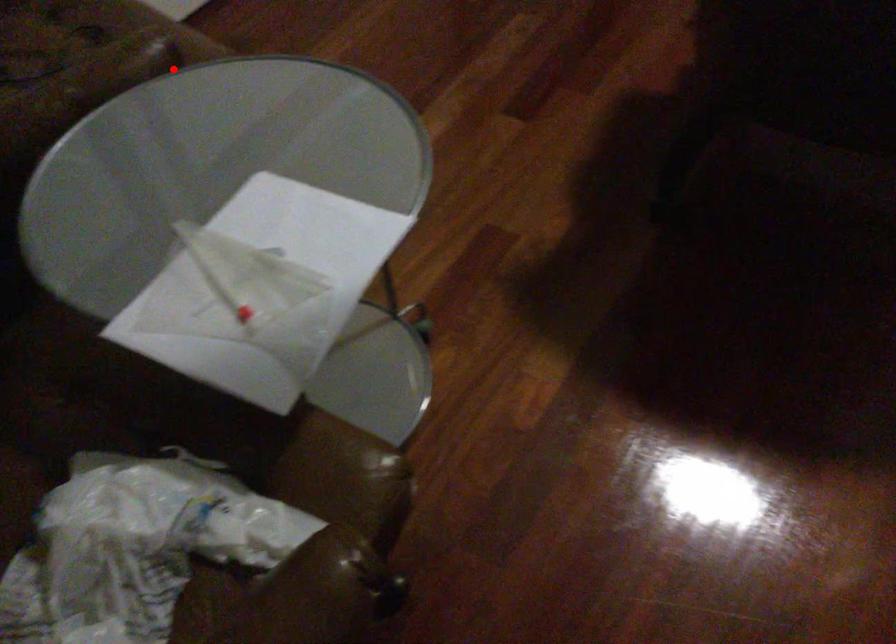
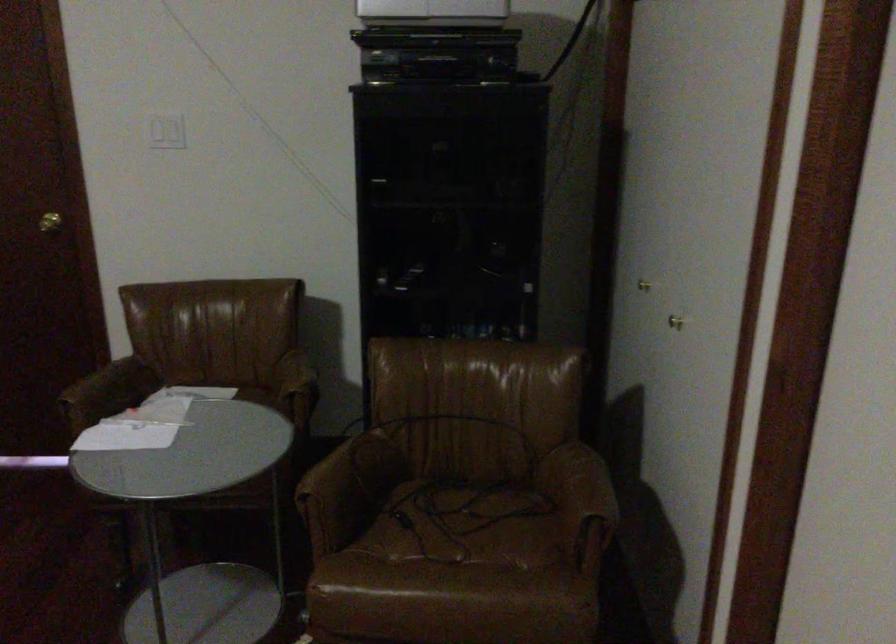
Question: I am providing you with two images of the same scene from different viewpoints. In image1, a red point is highlighted. Considering the same 3D point in image2, which of the following is correct?

Choices:
 (A) It is closer
 (B) It is farther

Answer: (B)